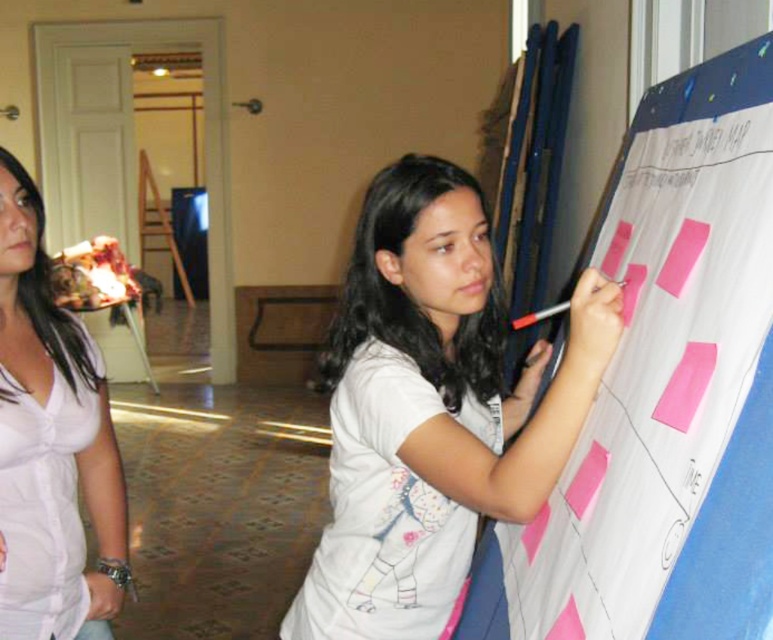
Looking at this image, you are an interior designer assessing the layout of this room. The white satin blouse at left and the white plastic pen at upper right are both on the same wall. If you want to hang a picture frame that is 1 meter wide between them, will there be enough space?

The white satin blouse at left might be wider than the white plastic pen at upper right, so there may not be enough space to fit a 1 meter wide picture frame between them. Measure the distance first before hanging.

You are standing in front of the flip chart and want to place a new sticky note closer to the camera. Which of the two points, point (472, 204) or point (564, 301), should you choose?

→ Point (472, 204) is closer to the camera than point (564, 301), so you should choose point (472, 204) to place the sticky note closer to the camera.

You are organizing a workshop and need to ensure that all materials are accessible. You have a white cotton shirt at center and a white plastic pen at upper right. Which object is bigger and would be easier to grab quickly?

The white cotton shirt at center is larger in size than the white plastic pen at upper right, so it would be easier to grab quickly.